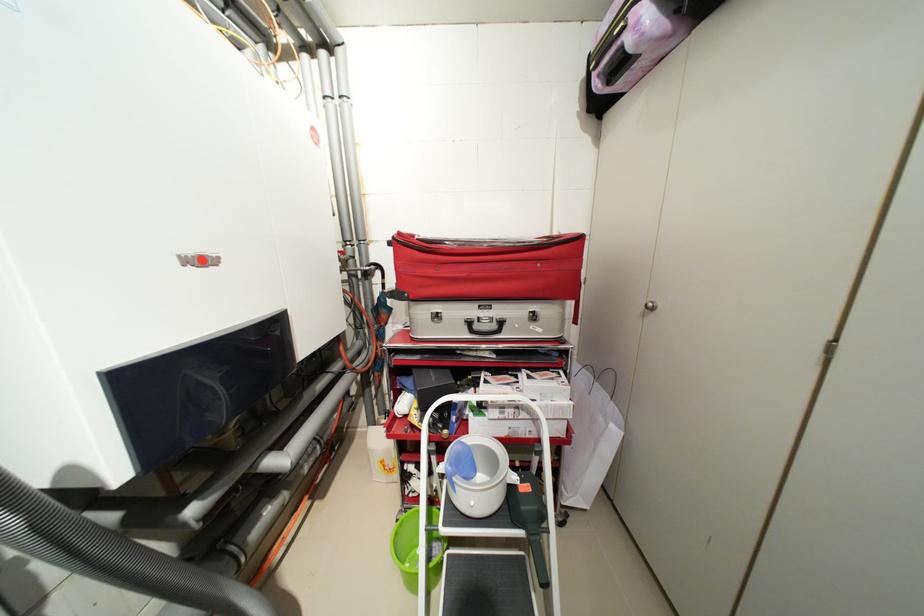
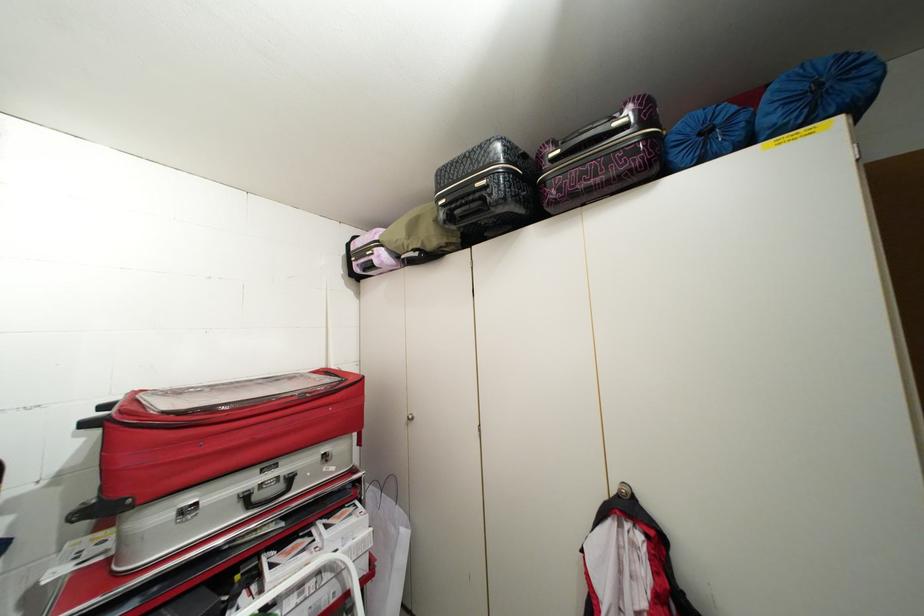
Question: The camera is either moving clockwise (left) or counter-clockwise (right) around the object. The first image is from the beginning of the video and the second image is from the end. Is the camera moving left or right when shooting the video?

Choices:
 (A) Left
 (B) Right

Answer: (A)